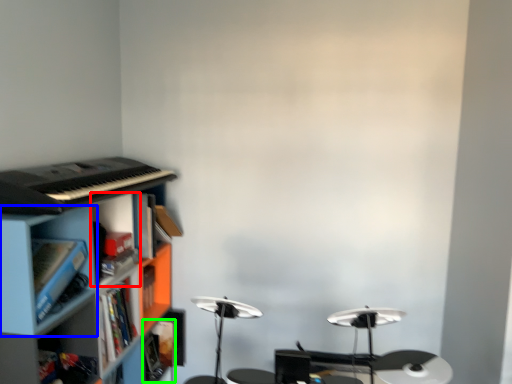
Question: Considering the real-world distances, which object is farthest from cabinet (highlighted by a red box)? cabinet (highlighted by a blue box) or book (highlighted by a green box)?

Choices:
 (A) cabinet
 (B) book

Answer: (B)